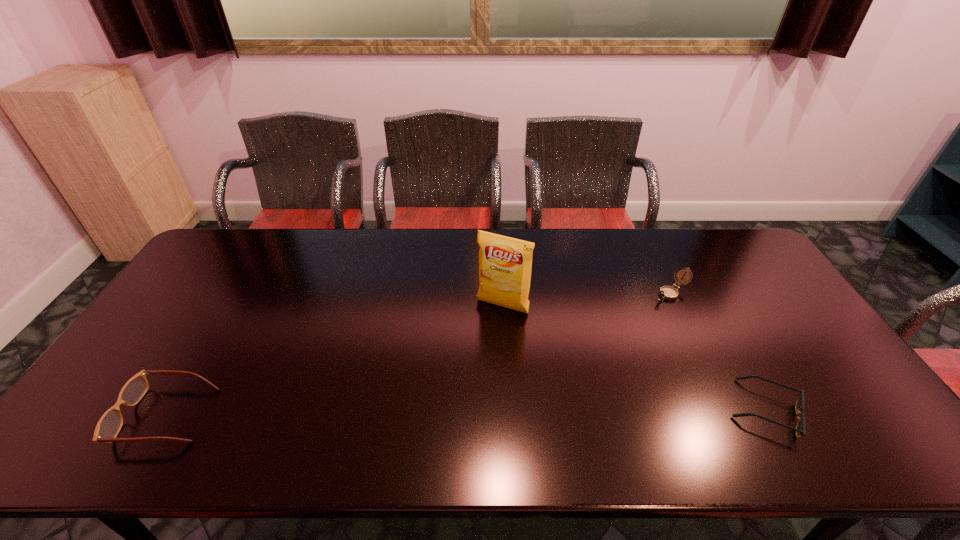
Identify the location of spectacles. The width and height of the screenshot is (960, 540). (109, 425).

You are a GUI agent. You are given a task and a screenshot of the screen. Output one action in this format:
    pyautogui.click(x=<x>, y=<y>)
    Task: Click on the leftmost object
    Image resolution: width=960 pixels, height=540 pixels.
    Given the screenshot: What is the action you would take?
    pyautogui.click(x=109, y=425)

At what (x,y) coordinates should I click in order to perform the action: click on sunglasses. Please return your answer as a coordinate pair (x, y). The width and height of the screenshot is (960, 540). Looking at the image, I should click on (800, 429).

This screenshot has height=540, width=960. What are the coordinates of `the tallest object` in the screenshot? It's located at (505, 263).

You are a GUI agent. You are given a task and a screenshot of the screen. Output one action in this format:
    pyautogui.click(x=<x>, y=<y>)
    Task: Click on the third object from right to left
    This screenshot has width=960, height=540.
    Given the screenshot: What is the action you would take?
    pyautogui.click(x=505, y=263)

Identify the location of compass. This screenshot has width=960, height=540. (666, 292).

Identify the location of free space located 0.100m on the front-facing side of the third tallest object. The image size is (960, 540). (84, 415).

Find the location of a particular element. Image resolution: width=960 pixels, height=540 pixels. free space located 0.050m on the front-facing side of the third tallest object is located at coordinates (105, 415).

Where is `free space located on the lenses of the sunglasses`? free space located on the lenses of the sunglasses is located at coordinates (844, 410).

The image size is (960, 540). I want to click on free location located on the front of the second object from left to right with the logo, so click(444, 411).